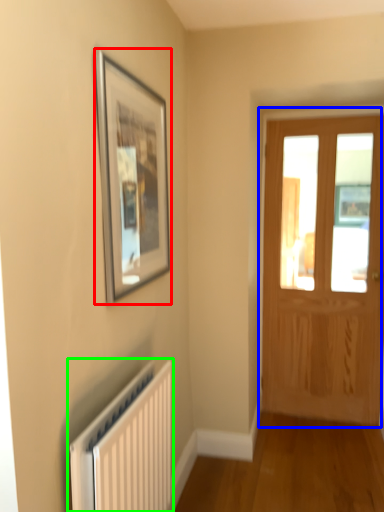
Question: Which object is the farthest from picture frame (highlighted by a red box)? Choose among these: door (highlighted by a blue box) or radiator (highlighted by a green box).

Choices:
 (A) door
 (B) radiator

Answer: (A)